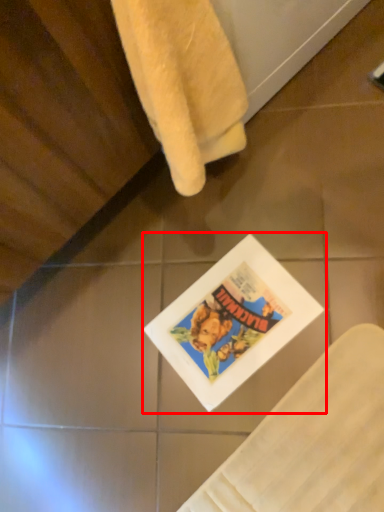
Question: Observing the image, what is the correct spatial positioning of comic book (annotated by the red box) in reference to towel?

Choices:
 (A) left
 (B) right

Answer: (B)